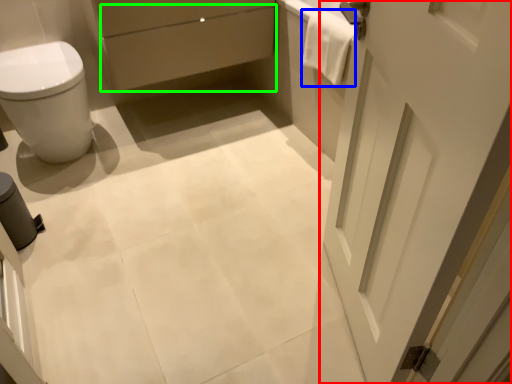
Question: Which is nearer to the door (highlighted by a red box)? material (highlighted by a blue box) or drawer (highlighted by a green box).

Choices:
 (A) material
 (B) drawer

Answer: (A)